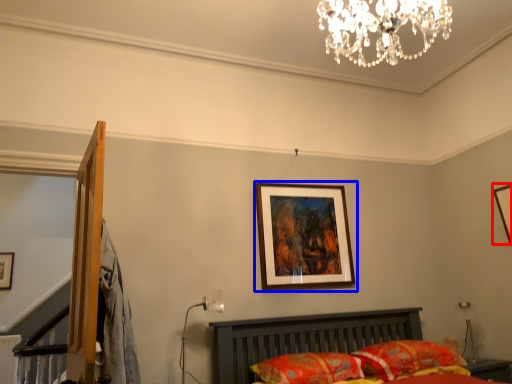
Question: Which point is further to the camera, picture frame (highlighted by a red box) or picture frame (highlighted by a blue box)?

Choices:
 (A) picture frame
 (B) picture frame

Answer: (A)